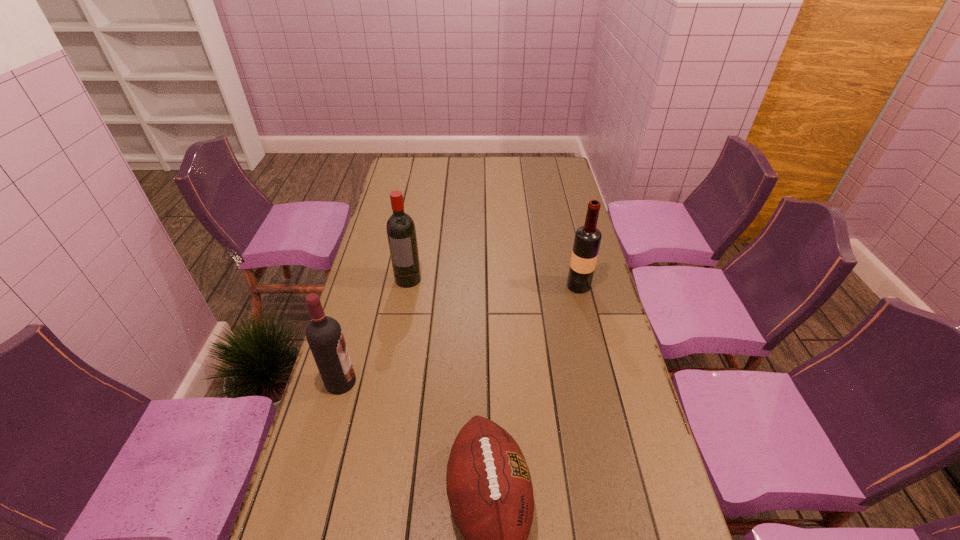
The height and width of the screenshot is (540, 960). What are the coordinates of `free region at the right edge` in the screenshot? It's located at (646, 504).

This screenshot has height=540, width=960. Find the location of `blank region between the leftmost wine bottle and the rightmost object`. blank region between the leftmost wine bottle and the rightmost object is located at coordinates (460, 334).

Locate an element on the screen. vacant space that is in between the third object from right to left and the rightmost wine bottle is located at coordinates 493,282.

Locate an element on the screen. vacant region between the leftmost wine bottle and the rightmost object is located at coordinates (460, 334).

Where is `object that stands as the closest to the shortest object`? The width and height of the screenshot is (960, 540). object that stands as the closest to the shortest object is located at coordinates (324, 335).

Locate an element on the screen. This screenshot has height=540, width=960. object that stands as the second closest to the rightmost wine bottle is located at coordinates (488, 483).

This screenshot has width=960, height=540. What are the coordinates of `the third closest wine bottle to the second object from right to left` in the screenshot? It's located at (401, 232).

At what (x,y) coordinates should I click in order to perform the action: click on wine bottle that can be found as the second closest to the leftmost object. Please return your answer as a coordinate pair (x, y). Looking at the image, I should click on (587, 240).

I want to click on vacant point that satisfies the following two spatial constraints: 1. on the label of the second object from left to right; 2. on the left side of the rightmost wine bottle, so click(407, 286).

Image resolution: width=960 pixels, height=540 pixels. I want to click on free space that satisfies the following two spatial constraints: 1. on the label of the rightmost object; 2. on the right side of the third object from right to left, so click(407, 286).